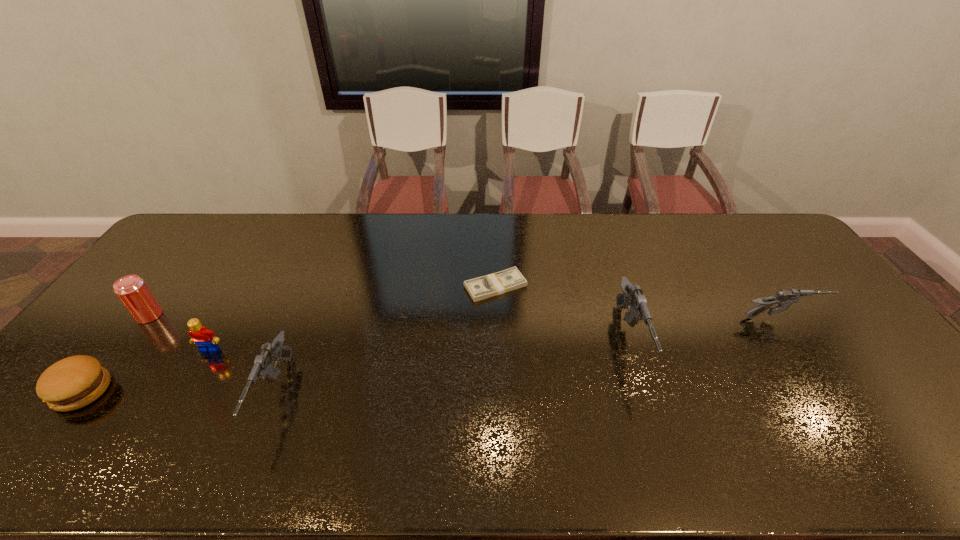
At what (x,y) coordinates should I click in order to perform the action: click on vacant point that satisfies the following two spatial constraints: 1. at the barrel of the rightmost gun; 2. at the barrel of the second object from right to left. Please return your answer as a coordinate pair (x, y). Looking at the image, I should click on (796, 342).

Identify the location of free spot that satisfies the following two spatial constraints: 1. at the barrel of the shortest gun; 2. on the front-facing side of the Lego. (802, 350).